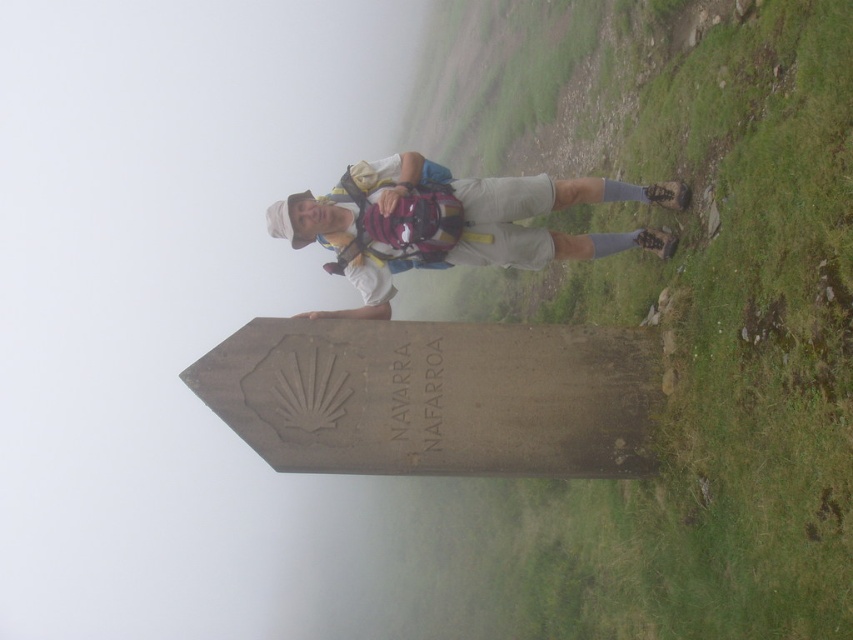
Does smooth stone marker at center have a lesser width compared to matte white shirt at center?

Incorrect, smooth stone marker at center's width is not less than matte white shirt at center's.

Who is shorter, smooth stone marker at center or matte white shirt at center?

matte white shirt at center

The height and width of the screenshot is (640, 853). What do you see at coordinates (663, 314) in the screenshot?
I see `smooth stone marker at center` at bounding box center [663, 314].

Locate an element on the screen. The height and width of the screenshot is (640, 853). smooth stone marker at center is located at coordinates (663, 314).

Which is more to the right, gray stone signpost at center or matte white shirt at center?

gray stone signpost at center is more to the right.

Is gray stone signpost at center bigger than matte white shirt at center?

Yes, gray stone signpost at center is bigger than matte white shirt at center.

I want to click on gray stone signpost at center, so click(x=437, y=396).

The image size is (853, 640). Identify the location of gray stone signpost at center. (437, 396).

Who is more forward, (718, 260) or (488, 368)?

Point (718, 260)

Where is `smooth stone marker at center`? The image size is (853, 640). smooth stone marker at center is located at coordinates (663, 314).